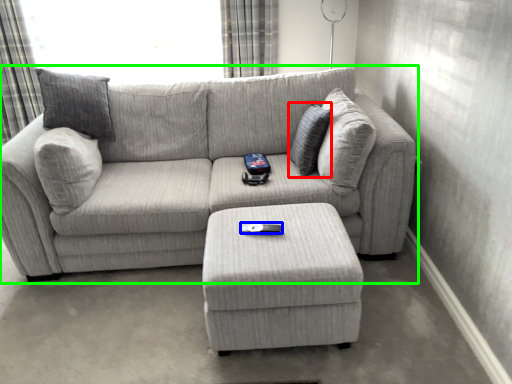
Question: Which object is the closest to the pillow (highlighted by a red box)? Choose among these: remote (highlighted by a blue box) or studio couch (highlighted by a green box).

Choices:
 (A) remote
 (B) studio couch

Answer: (B)